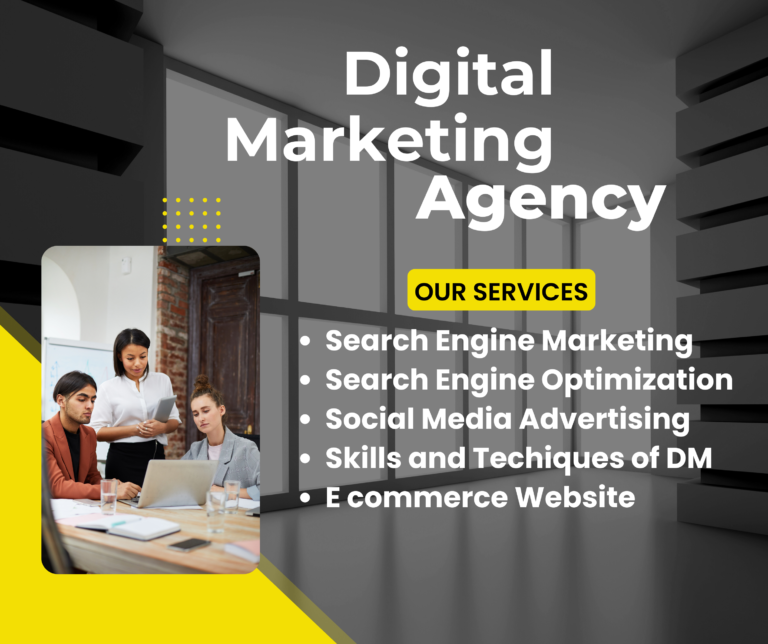
The height and width of the screenshot is (644, 768). Find the location of `floor`. floor is located at coordinates (418, 608).